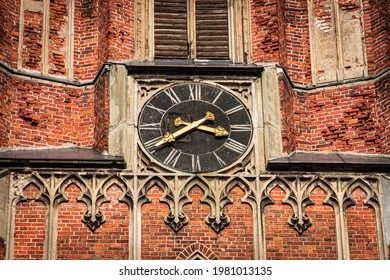
Locate an element on the screen. This screenshot has height=280, width=390. clock face is located at coordinates (195, 141).